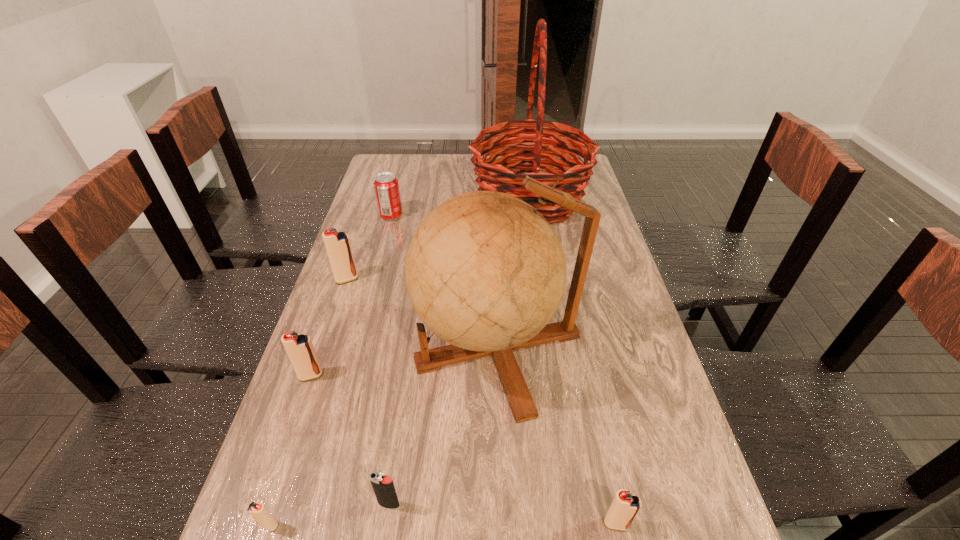
Choose which object is the sixth nearest neighbor to the tallest object. Please provide its 2D coordinates. Your answer should be formatted as a tuple, i.e. [(x, y)], where the tuple contains the x and y coordinates of a point satisfying the conditions above.

[(625, 506)]

Identify the location of the second closest igniter to the seventh shortest object. (625, 506).

Locate which igniter ranks fourth in proximity to the third nearest object. Please provide its 2D coordinates. Your answer should be formatted as a tuple, i.e. [(x, y)], where the tuple contains the x and y coordinates of a point satisfying the conditions above.

[(337, 244)]

Locate an element on the screen. This screenshot has height=540, width=960. red igniter that is the closest to the sixth nearest object is located at coordinates (299, 348).

Where is `the closest red igniter to the fifth object from right to left`? the closest red igniter to the fifth object from right to left is located at coordinates (337, 244).